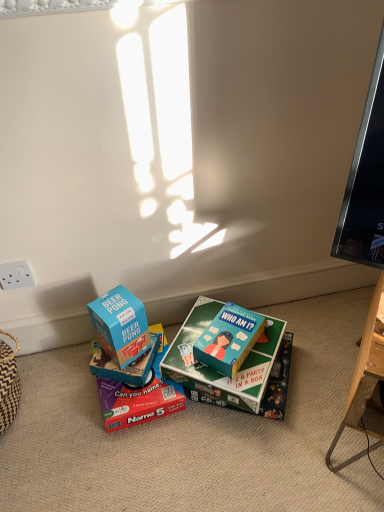
What do you see at coordinates (229, 339) in the screenshot? I see `teal matte board game at center, which is counted as the 1th box, starting from the right` at bounding box center [229, 339].

Identify the location of teal matte board game at center, which is the 5th box from left to right. (229, 339).

What are the coordinates of `white plastic power outlet at lower left` in the screenshot? It's located at (15, 275).

At what (x,y) coordinates should I click in order to perform the action: click on blue cardboard box at center, the second box when ordered from left to right. Please return your answer as a coordinate pair (x, y). This screenshot has width=384, height=512. Looking at the image, I should click on (128, 365).

The width and height of the screenshot is (384, 512). Describe the element at coordinates (128, 365) in the screenshot. I see `blue cardboard box at center, the second box when ordered from left to right` at that location.

Locate an element on the screen. Image resolution: width=384 pixels, height=512 pixels. teal matte board game at center, the second box positioned from the right is located at coordinates (215, 370).

Find the location of `blue cardboard box at center, the 1th box from the left`. blue cardboard box at center, the 1th box from the left is located at coordinates (120, 325).

Can teal matte board game at center, the second box positioned from the right, be found inside blue cardboard box at center, marked as the 4th box in a right-to-left arrangement?

Actually, teal matte board game at center, the second box positioned from the right, is outside blue cardboard box at center, marked as the 4th box in a right-to-left arrangement.

Is blue cardboard box at center, the second box when ordered from left to right, looking in the opposite direction of teal matte board game at center, the second box positioned from the right?

That's not correct — blue cardboard box at center, the second box when ordered from left to right, is not looking away from teal matte board game at center, the second box positioned from the right.

Considering their positions, is blue cardboard box at center, the second box when ordered from left to right, located in front of or behind teal matte board game at center, arranged as the 4th box when viewed from the left?

Visually, blue cardboard box at center, the second box when ordered from left to right, is located behind teal matte board game at center, arranged as the 4th box when viewed from the left.

Based on their sizes in the image, would you say blue cardboard box at center, the second box when ordered from left to right, is bigger or smaller than teal matte board game at center, the second box positioned from the right?

Considering their sizes, blue cardboard box at center, the second box when ordered from left to right, takes up less space than teal matte board game at center, the second box positioned from the right.

How far apart are white plastic power outlet at lower left and teal matte board game at center, which is counted as the 1th box, starting from the right?

white plastic power outlet at lower left and teal matte board game at center, which is counted as the 1th box, starting from the right, are 21.67 inches apart.

Which is correct: white plastic power outlet at lower left is inside teal matte board game at center, which is the 5th box from left to right, or outside of it?

The correct answer is: outside.

Is white plastic power outlet at lower left aimed at teal matte board game at center, which is the 5th box from left to right?

No, white plastic power outlet at lower left is not aimed at teal matte board game at center, which is the 5th box from left to right.

From a real-world perspective, relative to teal matte board game at center, which is counted as the 1th box, starting from the right, is white plastic power outlet at lower left vertically above or below?

From a real-world perspective, white plastic power outlet at lower left is physically above teal matte board game at center, which is counted as the 1th box, starting from the right.

Which object is positioned more to the right, blue cardboard box at center, the 1th box from the left, or teal matte board game at center, arranged as the 4th box when viewed from the left?

teal matte board game at center, arranged as the 4th box when viewed from the left.

Considering the relative positions of blue cardboard box at center, acting as the 5th box starting from the right, and teal matte board game at center, arranged as the 4th box when viewed from the left, in the image provided, is blue cardboard box at center, acting as the 5th box starting from the right, in front of teal matte board game at center, arranged as the 4th box when viewed from the left,?

Yes.

How distant is blue cardboard box at center, the 1th box from the left, from teal matte board game at center, the second box positioned from the right?

7.74 inches.

From a real-world perspective, which is physically above, teal matte board game at center, which is the 5th box from left to right, or blue cardboard box at center, marked as the 4th box in a right-to-left arrangement?

In real-world perspective, teal matte board game at center, which is the 5th box from left to right, is above.

From the image's perspective, which is below, teal matte board game at center, which is counted as the 1th box, starting from the right, or blue cardboard box at center, the second box when ordered from left to right?

blue cardboard box at center, the second box when ordered from left to right, is shown below in the image.

Considering the sizes of teal matte board game at center, which is the 5th box from left to right, and blue cardboard box at center, the second box when ordered from left to right, in the image, is teal matte board game at center, which is the 5th box from left to right, wider or thinner than blue cardboard box at center, the second box when ordered from left to right,?

In the image, teal matte board game at center, which is the 5th box from left to right, appears to be wider than blue cardboard box at center, the second box when ordered from left to right.

Is teal matte board game at center, which is the 5th box from left to right, spatially inside blue cardboard box at center, the second box when ordered from left to right, or outside of it?

teal matte board game at center, which is the 5th box from left to right, is not inside blue cardboard box at center, the second box when ordered from left to right, it's outside.

How many degrees apart are the facing directions of blue cardboard box at center, the second box when ordered from left to right, and teal matte board game at center, which is the 5th box from left to right?

blue cardboard box at center, the second box when ordered from left to right, and teal matte board game at center, which is the 5th box from left to right, are facing 14.7 degrees away from each other.

Is blue cardboard box at center, marked as the 4th box in a right-to-left arrangement, shorter than teal matte board game at center, which is the 5th box from left to right?

No.

Is blue cardboard box at center, the second box when ordered from left to right, turned away from teal matte board game at center, which is the 5th box from left to right?

blue cardboard box at center, the second box when ordered from left to right, does not have its back to teal matte board game at center, which is the 5th box from left to right.

Which is in front, point (96, 352) or point (206, 357)?

The point (206, 357) is closer.

In the scene shown: Which is in front, teal matte board game at center, the second box positioned from the right, or blue cardboard box at center, acting as the 5th box starting from the right?

blue cardboard box at center, acting as the 5th box starting from the right, is more forward.

Can we say teal matte board game at center, the second box positioned from the right, lies outside blue cardboard box at center, the 1th box from the left?

teal matte board game at center, the second box positioned from the right, is positioned outside blue cardboard box at center, the 1th box from the left.

Considering the points (216, 306) and (106, 305), which point is behind, point (216, 306) or point (106, 305)?

The point (216, 306) is behind.

Between teal matte board game at center, which is the 5th box from left to right, and blue cardboard box at center, the 1th box from the left, which one has larger size?

Bigger between the two is blue cardboard box at center, the 1th box from the left.

Is teal matte board game at center, which is counted as the 1th box, starting from the right, to the left of blue cardboard box at center, acting as the 5th box starting from the right, from the viewer's perspective?

In fact, teal matte board game at center, which is counted as the 1th box, starting from the right, is to the right of blue cardboard box at center, acting as the 5th box starting from the right.

How many degrees apart are the facing directions of teal matte board game at center, which is counted as the 1th box, starting from the right, and blue cardboard box at center, acting as the 5th box starting from the right?

They differ by 74.2 degrees in their facing directions.

From the image's perspective, does teal matte board game at center, which is counted as the 1th box, starting from the right, appear lower than blue cardboard box at center, acting as the 5th box starting from the right?

Correct, teal matte board game at center, which is counted as the 1th box, starting from the right, appears lower than blue cardboard box at center, acting as the 5th box starting from the right, in the image.

Identify the location of box that is the 1st one below the teal matte board game at center, the second box positioned from the right (from a real-world perspective). (128, 365).

This screenshot has height=512, width=384. Find the location of `power outlet above the teal matte board game at center, which is counted as the 1th box, starting from the right (from the image's perspective)`. power outlet above the teal matte board game at center, which is counted as the 1th box, starting from the right (from the image's perspective) is located at coordinates (15, 275).

In the scene shown: Which object lies further to the anchor point teal matte board game at center, which is the 5th box from left to right, matte cardboard box at center, which is counted as the 3th box, starting from the right, or blue cardboard box at center, acting as the 5th box starting from the right?

blue cardboard box at center, acting as the 5th box starting from the right, is further to teal matte board game at center, which is the 5th box from left to right.

Considering their positions, is blue cardboard box at center, marked as the 4th box in a right-to-left arrangement, positioned closer to white plastic power outlet at lower left than teal matte board game at center, which is the 5th box from left to right?

blue cardboard box at center, marked as the 4th box in a right-to-left arrangement, is closer to white plastic power outlet at lower left.

Which object lies nearer to the anchor point blue cardboard box at center, the second box when ordered from left to right, matte cardboard box at center, which is counted as the 3th box, starting from the right, or teal matte board game at center, which is counted as the 1th box, starting from the right?

matte cardboard box at center, which is counted as the 3th box, starting from the right.

Based on their spatial positions, is matte cardboard box at center, which is counted as the 3th box, starting from the right, or white plastic power outlet at lower left closer to blue cardboard box at center, marked as the 4th box in a right-to-left arrangement?

Among the two, matte cardboard box at center, which is counted as the 3th box, starting from the right, is located nearer to blue cardboard box at center, marked as the 4th box in a right-to-left arrangement.

Considering their positions, is blue cardboard box at center, the 1th box from the left, positioned further to teal matte board game at center, arranged as the 4th box when viewed from the left, than white plastic power outlet at lower left?

Among the two, white plastic power outlet at lower left is located further to teal matte board game at center, arranged as the 4th box when viewed from the left.

When comparing their distances from teal matte board game at center, the second box positioned from the right, does blue cardboard box at center, the second box when ordered from left to right, or teal matte board game at center, which is counted as the 1th box, starting from the right, seem closer?

teal matte board game at center, which is counted as the 1th box, starting from the right.

Looking at the image, which one is located further to white plastic power outlet at lower left, matte cardboard box at center, the 3th box positioned from the left, or blue cardboard box at center, the second box when ordered from left to right?

matte cardboard box at center, the 3th box positioned from the left.

Which object lies nearer to the anchor point blue cardboard box at center, the second box when ordered from left to right, teal matte board game at center, the second box positioned from the right, or matte cardboard box at center, the 3th box positioned from the left?

matte cardboard box at center, the 3th box positioned from the left.

You are a GUI agent. You are given a task and a screenshot of the screen. Output one action in this format:
    pyautogui.click(x=<x>, y=<y>)
    Task: Click on the box situated between matte cardboard box at center, the 3th box positioned from the left, and teal matte board game at center, which is counted as the 1th box, starting from the right, from left to right
    
    Given the screenshot: What is the action you would take?
    pyautogui.click(x=215, y=370)

Where is `box situated between white plastic power outlet at lower left and blue cardboard box at center, marked as the 4th box in a right-to-left arrangement, from left to right`? Image resolution: width=384 pixels, height=512 pixels. box situated between white plastic power outlet at lower left and blue cardboard box at center, marked as the 4th box in a right-to-left arrangement, from left to right is located at coordinates (120, 325).

Image resolution: width=384 pixels, height=512 pixels. I want to click on box situated between blue cardboard box at center, marked as the 4th box in a right-to-left arrangement, and teal matte board game at center, arranged as the 4th box when viewed from the left, from left to right, so click(x=140, y=395).